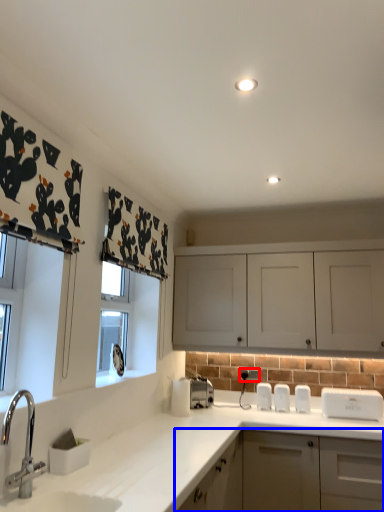
Question: Which point is further to the camera, electric outlet (highlighted by a red box) or cabinetry (highlighted by a blue box)?

Choices:
 (A) electric outlet
 (B) cabinetry

Answer: (A)